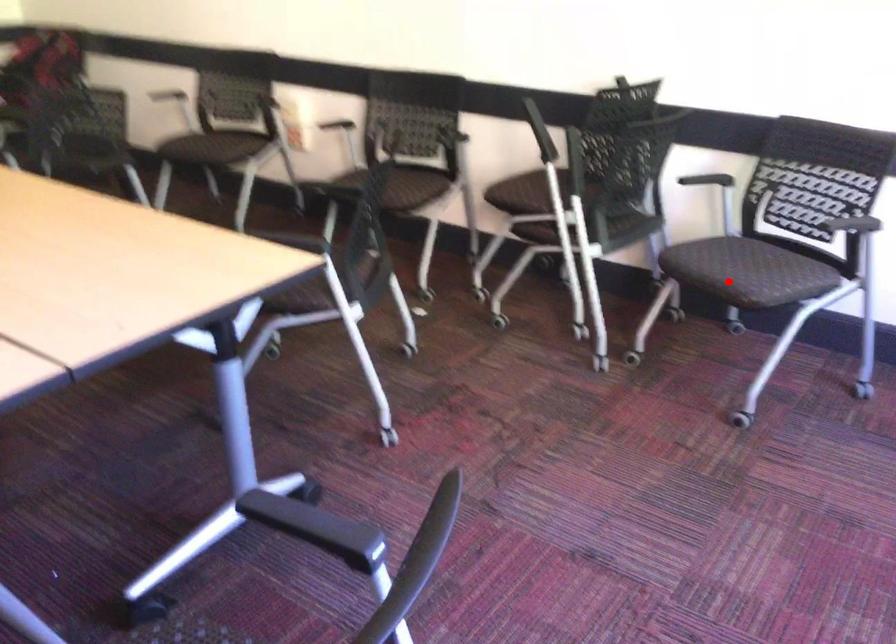
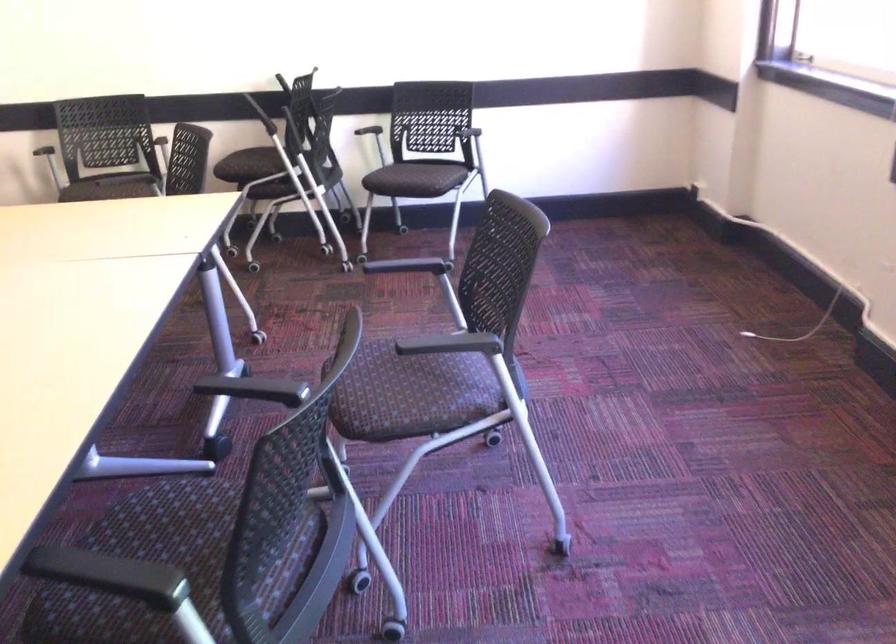
In the second image, find the point that corresponds to the highlighted location in the first image.

(415, 178)